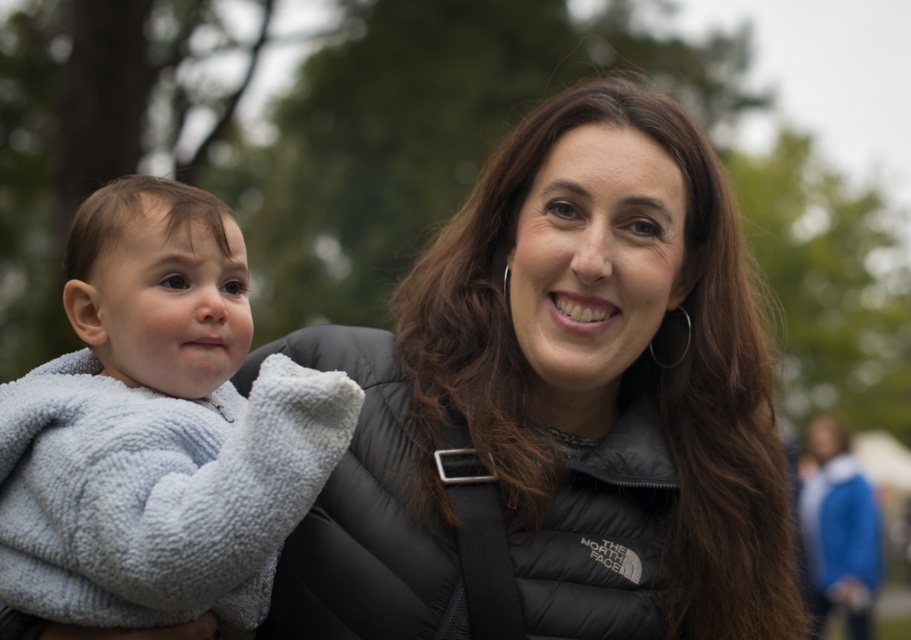
Question: Among these points, which one is nearest to the camera?

Choices:
 (A) (574, 125)
 (B) (265, 560)

Answer: (B)

Question: Does black puffer jacket at center have a lesser width compared to soft gray fleece at left?

Choices:
 (A) yes
 (B) no

Answer: (B)

Question: Is black puffer jacket at center positioned before soft gray fleece at left?

Choices:
 (A) yes
 (B) no

Answer: (B)

Question: Does black puffer jacket at center appear on the left side of soft gray fleece at left?

Choices:
 (A) yes
 (B) no

Answer: (B)